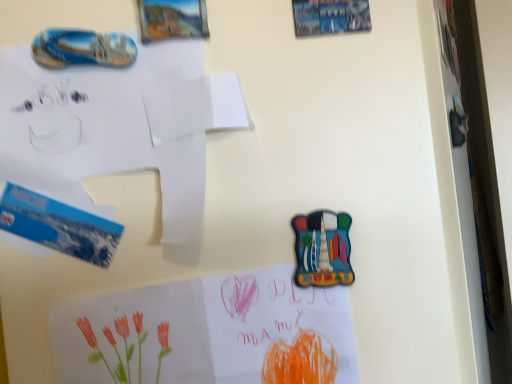
Question: From the image's perspective, is white paper at upper left, placed as the 1th paper when sorted from top to bottom, on watercolor paper at lower center, which ranks as the second paper in top-to-bottom order?

Choices:
 (A) no
 (B) yes

Answer: (B)

Question: Is watercolor paper at lower center, which ranks as the second paper in top-to-bottom order, inside white paper at upper left, which appears as the 2th paper when ordered from the bottom?

Choices:
 (A) yes
 (B) no

Answer: (B)

Question: Is white paper at upper left, which appears as the 2th paper when ordered from the bottom, bigger than watercolor paper at lower center, which ranks as the second paper in top-to-bottom order?

Choices:
 (A) yes
 (B) no

Answer: (A)

Question: Can you confirm if white paper at upper left, placed as the 1th paper when sorted from top to bottom, is smaller than watercolor paper at lower center, which ranks as the second paper in top-to-bottom order?

Choices:
 (A) no
 (B) yes

Answer: (A)

Question: Can you confirm if white paper at upper left, placed as the 1th paper when sorted from top to bottom, is thinner than watercolor paper at lower center, the 1th paper when ordered from bottom to top?

Choices:
 (A) no
 (B) yes

Answer: (A)

Question: Is white paper at upper left, placed as the 1th paper when sorted from top to bottom, behind watercolor paper at lower center, which ranks as the second paper in top-to-bottom order?

Choices:
 (A) yes
 (B) no

Answer: (B)

Question: Can you confirm if watercolor paper at lower center, the 1th paper when ordered from bottom to top, is taller than white paper at upper left, placed as the 1th paper when sorted from top to bottom?

Choices:
 (A) no
 (B) yes

Answer: (B)

Question: Considering the relative sizes of watercolor paper at lower center, which ranks as the second paper in top-to-bottom order, and white paper at upper left, which appears as the 2th paper when ordered from the bottom, in the image provided, is watercolor paper at lower center, which ranks as the second paper in top-to-bottom order, smaller than white paper at upper left, which appears as the 2th paper when ordered from the bottom,?

Choices:
 (A) no
 (B) yes

Answer: (B)

Question: Is watercolor paper at lower center, which ranks as the second paper in top-to-bottom order, turned away from white paper at upper left, placed as the 1th paper when sorted from top to bottom?

Choices:
 (A) no
 (B) yes

Answer: (A)

Question: Can you see watercolor paper at lower center, the 1th paper when ordered from bottom to top, touching white paper at upper left, which appears as the 2th paper when ordered from the bottom?

Choices:
 (A) no
 (B) yes

Answer: (A)

Question: From the image's perspective, is watercolor paper at lower center, the 1th paper when ordered from bottom to top, above white paper at upper left, placed as the 1th paper when sorted from top to bottom?

Choices:
 (A) yes
 (B) no

Answer: (B)

Question: Is watercolor paper at lower center, which ranks as the second paper in top-to-bottom order, positioned in front of white paper at upper left, which appears as the 2th paper when ordered from the bottom?

Choices:
 (A) no
 (B) yes

Answer: (A)

Question: In the image, is white paper at upper left, placed as the 1th paper when sorted from top to bottom, on the left side or the right side of watercolor paper at lower center, the 1th paper when ordered from bottom to top?

Choices:
 (A) left
 (B) right

Answer: (A)